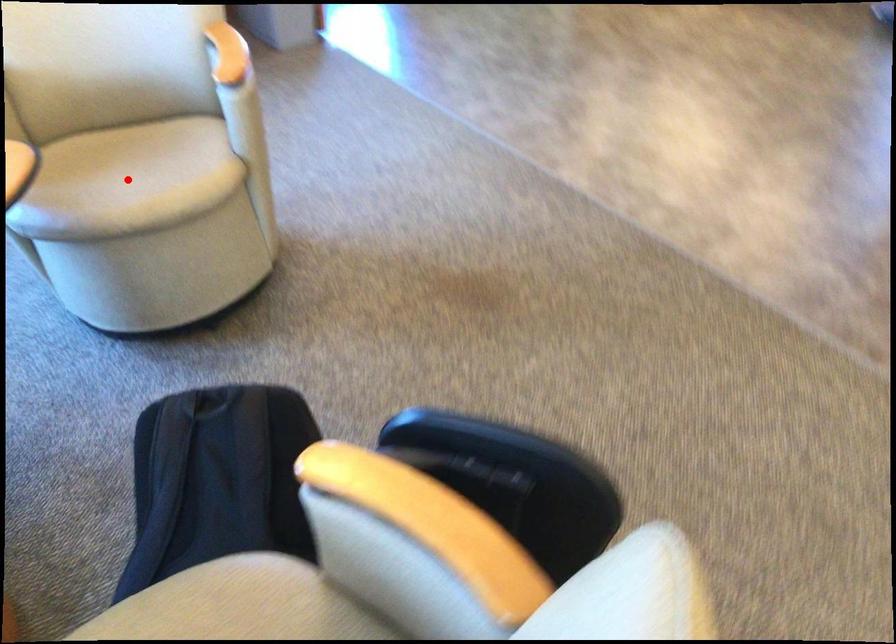
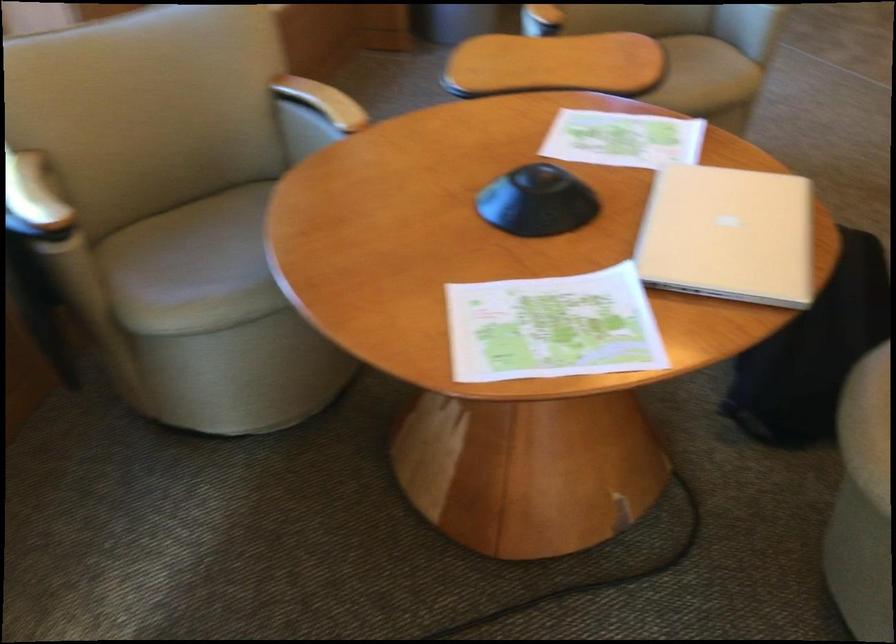
Question: I am providing you with two images of the same scene from different viewpoints. A red point is marked on the first image. Can you still see the location of the red point in image 2?

Choices:
 (A) Yes
 (B) No

Answer: (B)